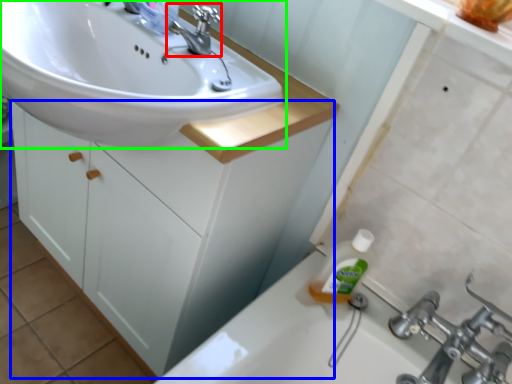
Question: Estimate the real-world distances between objects in this image. Which object is farther from tap (highlighted by a red box), bathroom cabinet (highlighted by a blue box) or sink (highlighted by a green box)?

Choices:
 (A) bathroom cabinet
 (B) sink

Answer: (A)